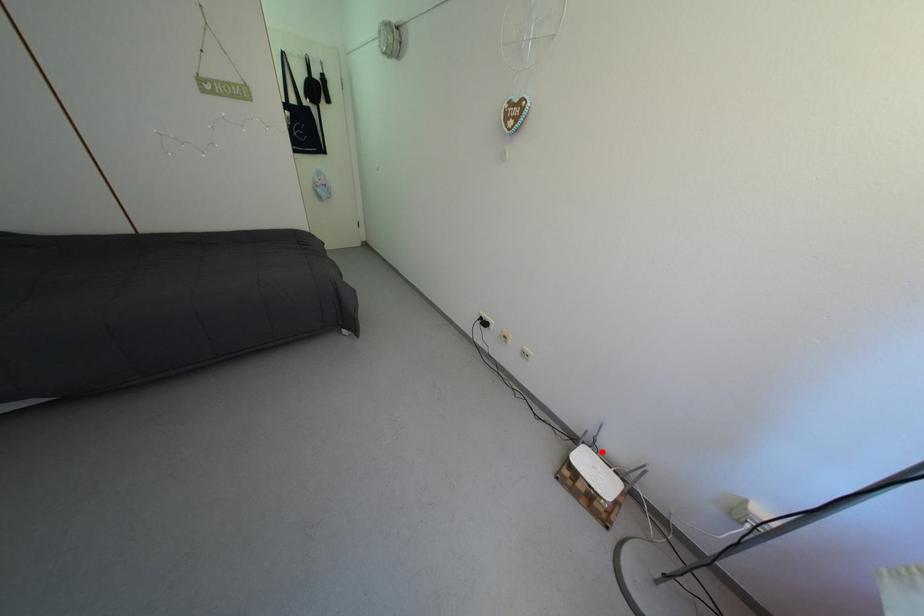
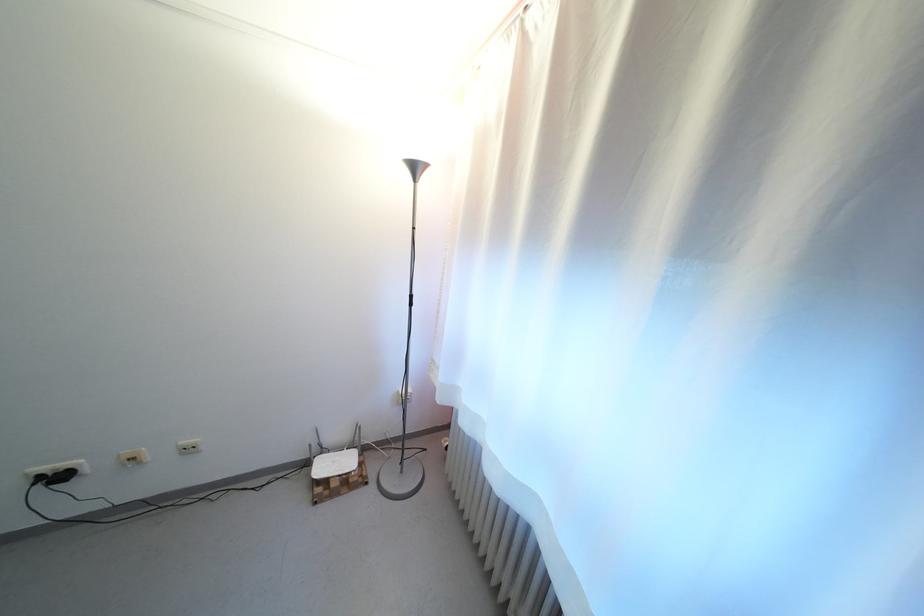
The point at the highlighted location is marked in the first image. Where is the corresponding point in the second image?

(332, 456)